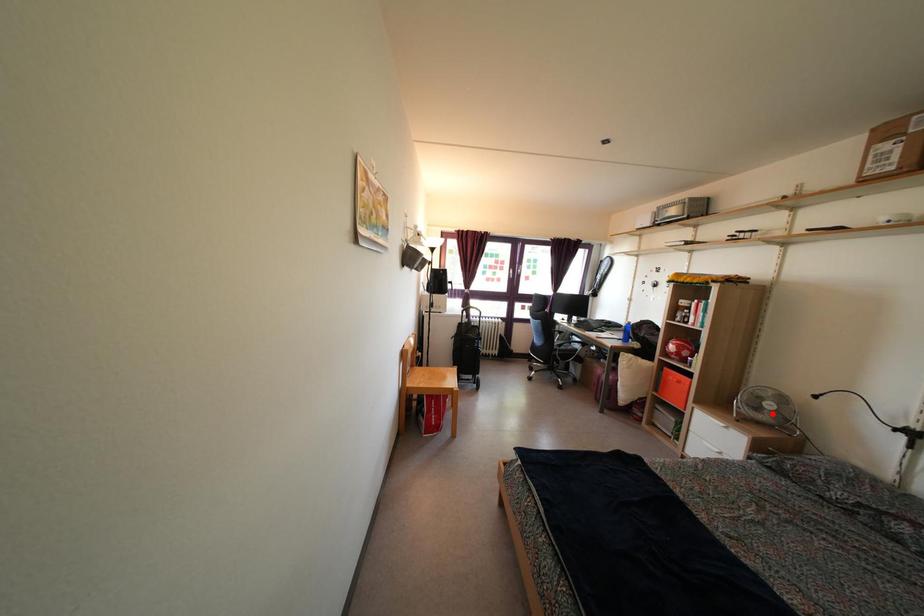
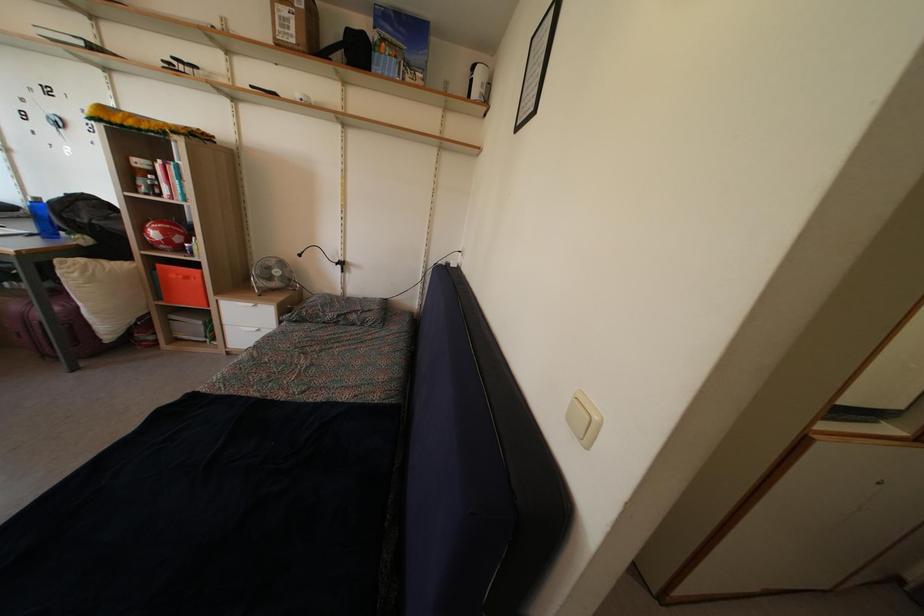
Where in the second image is the point corresponding to the highlighted location from the first image?

(280, 281)